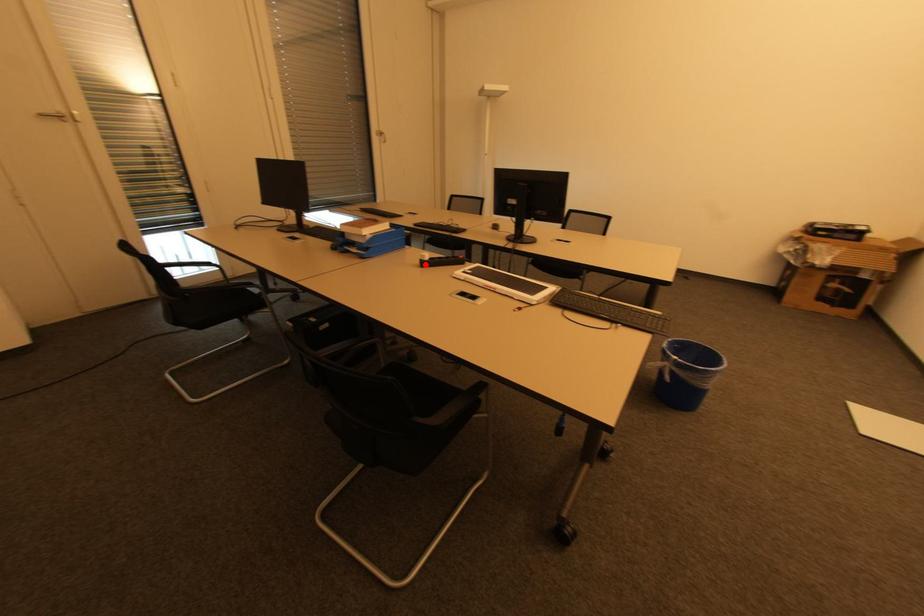
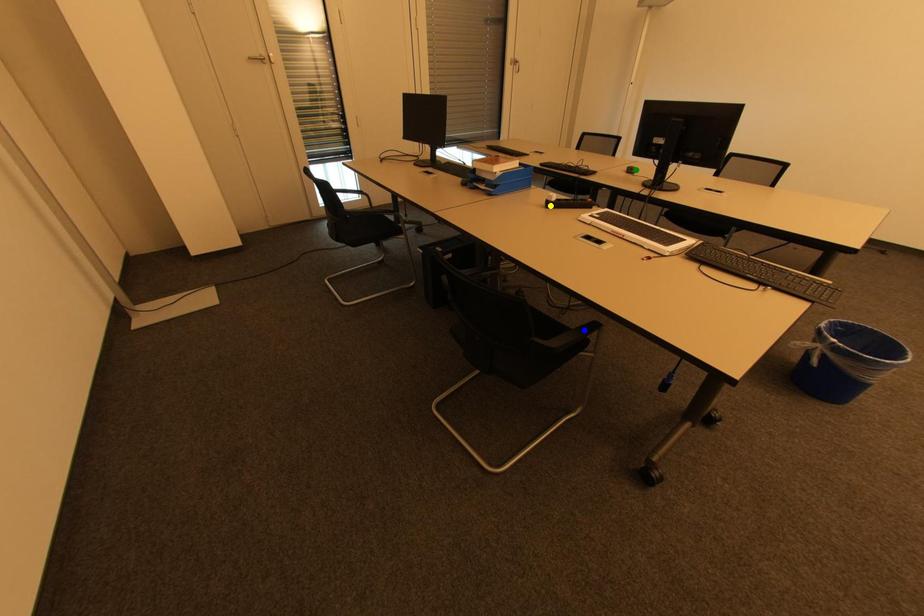
Question: I am providing you with two images of the same scene from different viewpoints. A red point is marked on the first image. You are given multiple points on the second image. Which point in image 2 is actually the same real-world point as the red point in image 1?

Choices:
 (A) blue point
 (B) green point
 (C) yellow point

Answer: (C)